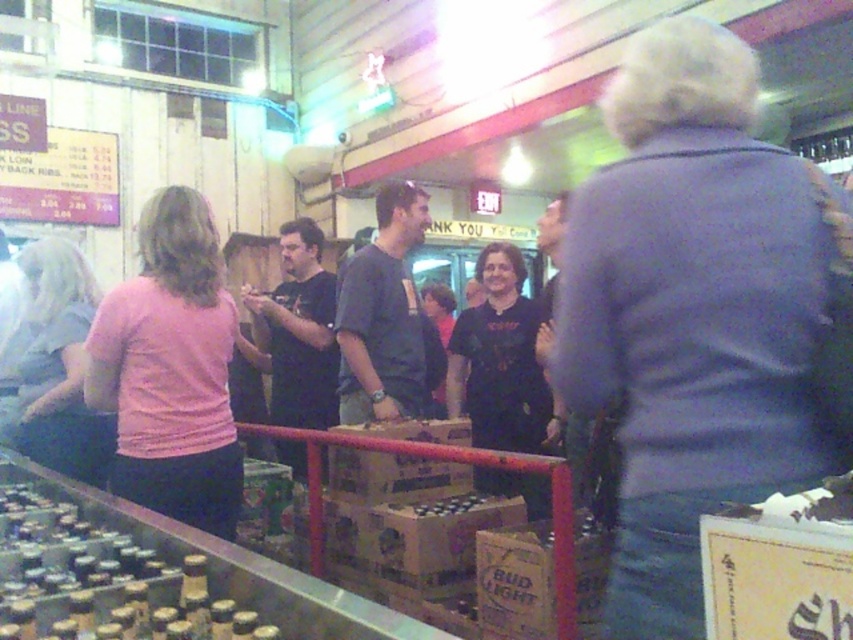
What do you see at coordinates (386, 317) in the screenshot? This screenshot has height=640, width=853. I see `dark gray t-shirt at center` at bounding box center [386, 317].

Between dark gray t-shirt at center and black matte shirt at center, which one is positioned higher?

Positioned higher is black matte shirt at center.

The width and height of the screenshot is (853, 640). What do you see at coordinates (386, 317) in the screenshot?
I see `dark gray t-shirt at center` at bounding box center [386, 317].

Locate an element on the screen. This screenshot has height=640, width=853. dark gray t-shirt at center is located at coordinates (386, 317).

Does purple sweater at center appear on the right side of matte pink shirt at left?

Correct, you'll find purple sweater at center to the right of matte pink shirt at left.

Is purple sweater at center to the left of matte pink shirt at left from the viewer's perspective?

No, purple sweater at center is not to the left of matte pink shirt at left.

Which is behind, point (784, 216) or point (103, 456)?

Positioned behind is point (103, 456).

You are a GUI agent. You are given a task and a screenshot of the screen. Output one action in this format:
    pyautogui.click(x=<x>, y=<y>)
    Task: Click on the purple sweater at center
    Image resolution: width=853 pixels, height=640 pixels.
    Given the screenshot: What is the action you would take?
    pyautogui.click(x=692, y=314)

Does pink matte shirt at center have a smaller size compared to black matte shirt at center?

Yes.

From the picture: Who is shorter, pink matte shirt at center or black matte shirt at center?

pink matte shirt at center

Between point (138, 300) and point (303, 298), which one is positioned behind?

The point (303, 298) is more distant.

Find the location of a particular element. Image resolution: width=853 pixels, height=640 pixels. pink matte shirt at center is located at coordinates (171, 369).